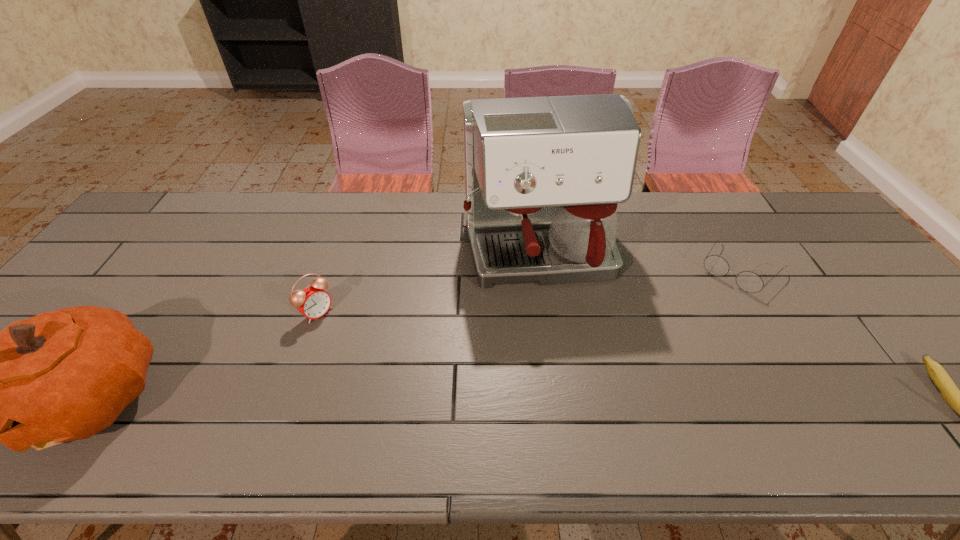
Find the location of `spectacles`. spectacles is located at coordinates (748, 281).

The image size is (960, 540). What are the coordinates of `the shortest object` in the screenshot? It's located at (748, 281).

At what (x,y) coordinates should I click in order to perform the action: click on coffee maker. Please return your answer as a coordinate pair (x, y). The image size is (960, 540). Looking at the image, I should click on (543, 175).

You are a GUI agent. You are given a task and a screenshot of the screen. Output one action in this format:
    pyautogui.click(x=<x>, y=<y>)
    Task: Click on the tallest object
    Image resolution: width=960 pixels, height=540 pixels.
    Given the screenshot: What is the action you would take?
    pyautogui.click(x=543, y=175)

Where is `alarm clock`? alarm clock is located at coordinates 313,302.

Find the location of `vacant space situated 0.170m on the temples of the shortest object`. vacant space situated 0.170m on the temples of the shortest object is located at coordinates (695, 323).

The height and width of the screenshot is (540, 960). In order to click on free space located 0.070m on the temples of the shortest object in this screenshot , I will do `click(711, 302)`.

The height and width of the screenshot is (540, 960). What are the coordinates of `blank space located 0.200m on the temples of the shortest object` in the screenshot? It's located at (689, 330).

Find the location of a particular element. The height and width of the screenshot is (540, 960). free space located on the front of the tallest object near the spout is located at coordinates (579, 407).

Where is `vacant space located on the front of the tallest object near the spout`? vacant space located on the front of the tallest object near the spout is located at coordinates (562, 344).